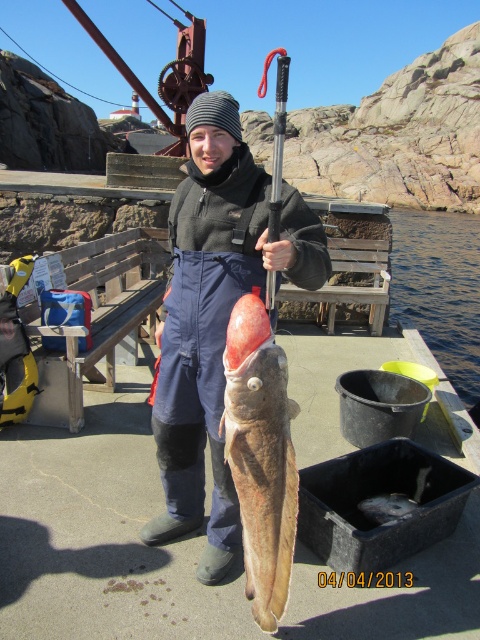
You are a safety inspector checking the dock. You notice the dark blue waterproof suit at center and the shiny silver fish at center. Based on their sizes, which one is more likely to block the emergency exit located at the back of the dock?

The dark blue waterproof suit at center might be wider than the shiny silver fish at center, so it is more likely to block the emergency exit.

You are a photographer positioned at the edge of the dock and want to take a closeup shot of the dark blue waterproof suit at center. Considering your current position, is the distance sufficient to capture clear details of the suit without needing to move closer?

The dark blue waterproof suit at center is 2.01 meters away from viewer, so yes, the distance is sufficient to capture clear details without needing to move closer as 2.01 meters is a reasonable distance for a closeup shot.

Based on the scene described, which object is taller between the dark blue waterproof suit at center and the smooth brown fish at center?

The dark blue waterproof suit at center is taller than the smooth brown fish at center according to the description.